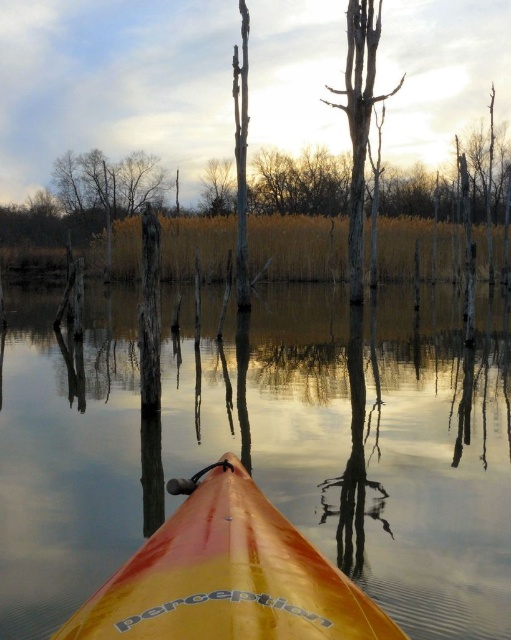
Question: Does glossy water at center have a smaller size compared to brown wood tree at upper center?

Choices:
 (A) yes
 (B) no

Answer: (B)

Question: Can you confirm if yellow glossy kayak at center is thinner than brown wood tree at upper center?

Choices:
 (A) yes
 (B) no

Answer: (A)

Question: Where is glossy water at center located in relation to brown wood tree at upper center in the image?

Choices:
 (A) left
 (B) right

Answer: (B)

Question: Among these points, which one is farthest from the camera?

Choices:
 (A) (271, 522)
 (B) (229, 202)

Answer: (B)

Question: Among these objects, which one is farthest from the camera?

Choices:
 (A) glossy water at center
 (B) yellow glossy kayak at center

Answer: (A)

Question: Which point appears closest to the camera in this image?

Choices:
 (A) (142, 468)
 (B) (213, 193)
 (C) (261, 508)
 (D) (394, 92)

Answer: (C)